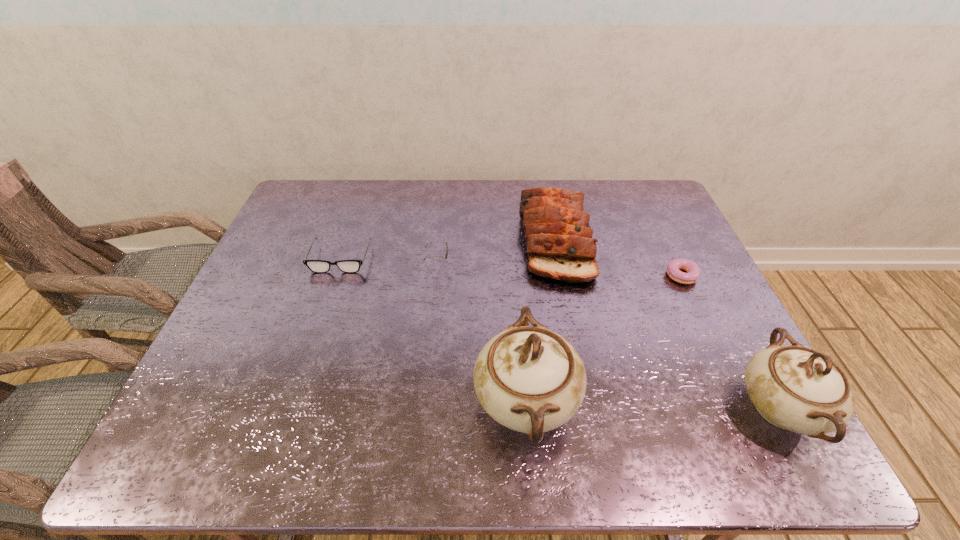
You are a GUI agent. You are given a task and a screenshot of the screen. Output one action in this format:
    pyautogui.click(x=<x>, y=<y>)
    Task: Click on the free location located 0.240m on the left of the taller chinaware
    This screenshot has width=960, height=540.
    Given the screenshot: What is the action you would take?
    pyautogui.click(x=364, y=402)

You are a GUI agent. You are given a task and a screenshot of the screen. Output one action in this format:
    pyautogui.click(x=<x>, y=<y>)
    Task: Click on the vacant space located 0.370m on the left of the right chinaware
    This screenshot has height=540, width=960.
    Given the screenshot: What is the action you would take?
    pyautogui.click(x=564, y=409)

Locate an element on the screen. The height and width of the screenshot is (540, 960). free space located on the front-facing side of the leftmost object is located at coordinates (313, 338).

The width and height of the screenshot is (960, 540). I want to click on blank area located on the right of the bread, so click(605, 240).

You are a GUI agent. You are given a task and a screenshot of the screen. Output one action in this format:
    pyautogui.click(x=<x>, y=<y>)
    Task: Click on the vacant space located 0.340m on the left of the doughnut
    
    Given the screenshot: What is the action you would take?
    pyautogui.click(x=546, y=279)

Identify the location of free spot located in front of the lenses of the fifth object from right to left. (553, 265).

Locate an element on the screen. Image resolution: width=960 pixels, height=540 pixels. object positioned at the far edge is located at coordinates (559, 239).

Locate an element on the screen. The height and width of the screenshot is (540, 960). object at the left edge is located at coordinates (317, 266).

At what (x,y) coordinates should I click in order to perform the action: click on chinaware located in the right edge section of the desktop. Please return your answer as a coordinate pair (x, y). Looking at the image, I should click on [795, 388].

Where is `doughnut that is positioned at the right edge`? doughnut that is positioned at the right edge is located at coordinates coord(674,266).